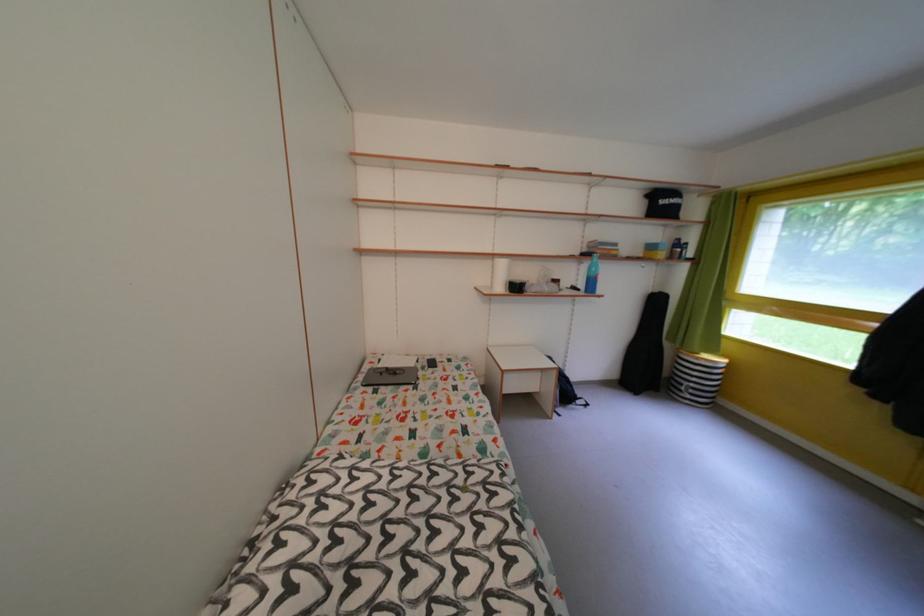
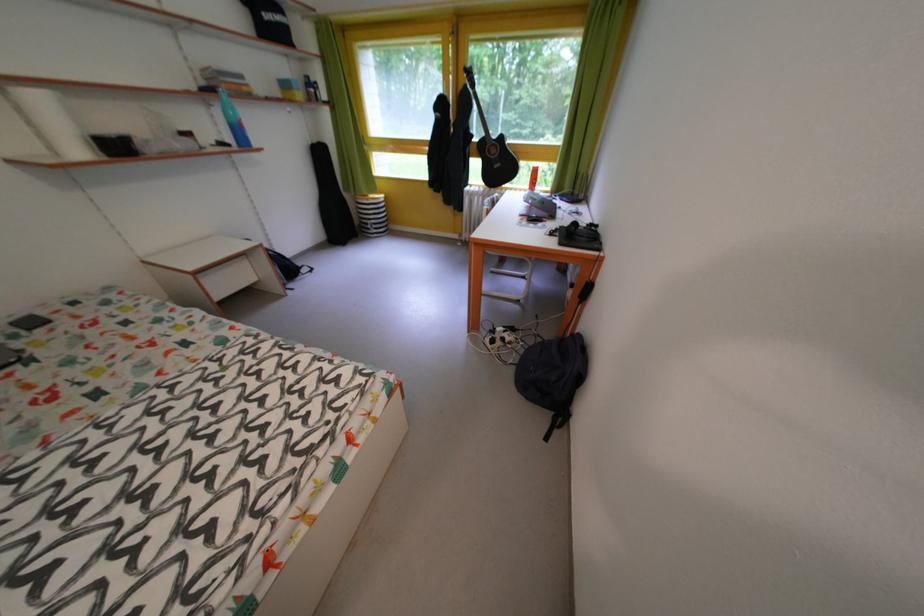
How did the camera likely rotate?

The rotation direction of the camera is right-down.